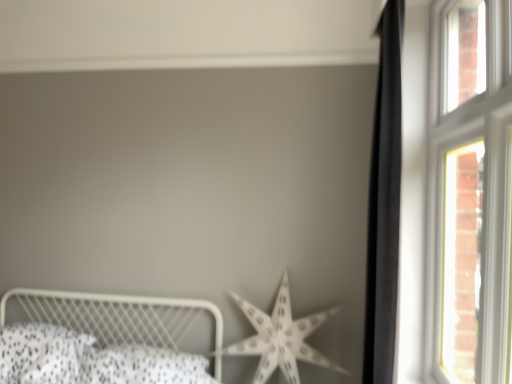
Question: Does white metal bed at lower left have a lesser width compared to black matte curtain at right?

Choices:
 (A) no
 (B) yes

Answer: (A)

Question: Is the depth of white metal bed at lower left less than that of black matte curtain at right?

Choices:
 (A) yes
 (B) no

Answer: (A)

Question: From the image's perspective, is white metal bed at lower left located beneath black matte curtain at right?

Choices:
 (A) no
 (B) yes

Answer: (B)

Question: Is white metal bed at lower left looking in the opposite direction of black matte curtain at right?

Choices:
 (A) no
 (B) yes

Answer: (A)

Question: From a real-world perspective, is white metal bed at lower left located beneath black matte curtain at right?

Choices:
 (A) no
 (B) yes

Answer: (B)

Question: Would you say white metal bed at lower left is inside or outside black matte curtain at right?

Choices:
 (A) outside
 (B) inside

Answer: (A)

Question: Based on their sizes in the image, would you say white metal bed at lower left is bigger or smaller than black matte curtain at right?

Choices:
 (A) big
 (B) small

Answer: (A)

Question: Visually, is white metal bed at lower left positioned to the left or to the right of black matte curtain at right?

Choices:
 (A) left
 (B) right

Answer: (A)

Question: Is point (157, 319) closer or farther from the camera than point (393, 274)?

Choices:
 (A) closer
 (B) farther

Answer: (B)

Question: From their relative heights in the image, would you say white paper star at center is taller or shorter than black matte curtain at right?

Choices:
 (A) tall
 (B) short

Answer: (B)

Question: Considering the positions of white paper star at center and black matte curtain at right in the image, is white paper star at center wider or thinner than black matte curtain at right?

Choices:
 (A) thin
 (B) wide

Answer: (B)

Question: Which is correct: white paper star at center is inside black matte curtain at right, or outside of it?

Choices:
 (A) inside
 (B) outside

Answer: (B)

Question: Relative to black matte curtain at right, is white paper star at center in front or behind?

Choices:
 (A) behind
 (B) front

Answer: (A)

Question: Is white wooden window at right in front of or behind black matte curtain at right in the image?

Choices:
 (A) behind
 (B) front

Answer: (B)

Question: Looking at the image, does white wooden window at right seem bigger or smaller compared to black matte curtain at right?

Choices:
 (A) big
 (B) small

Answer: (A)